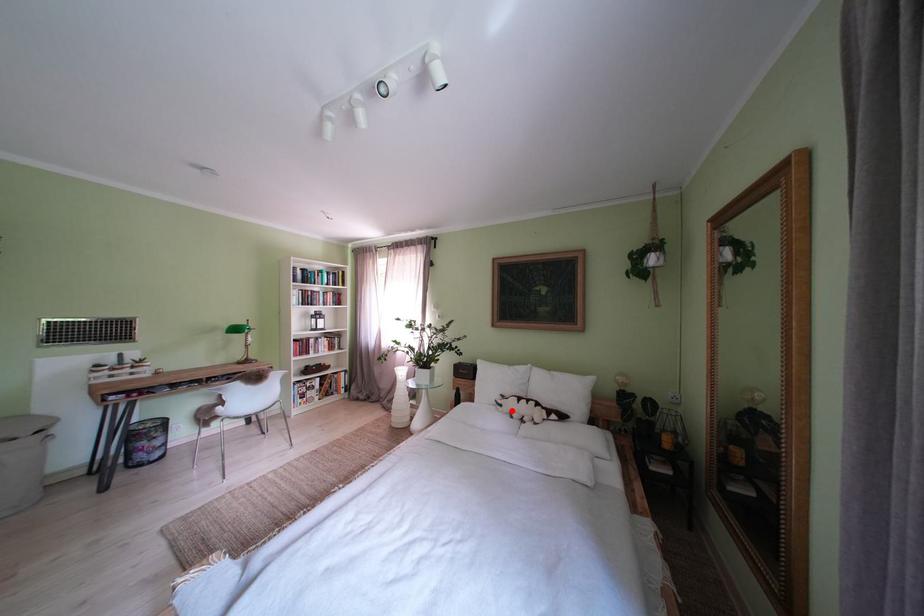
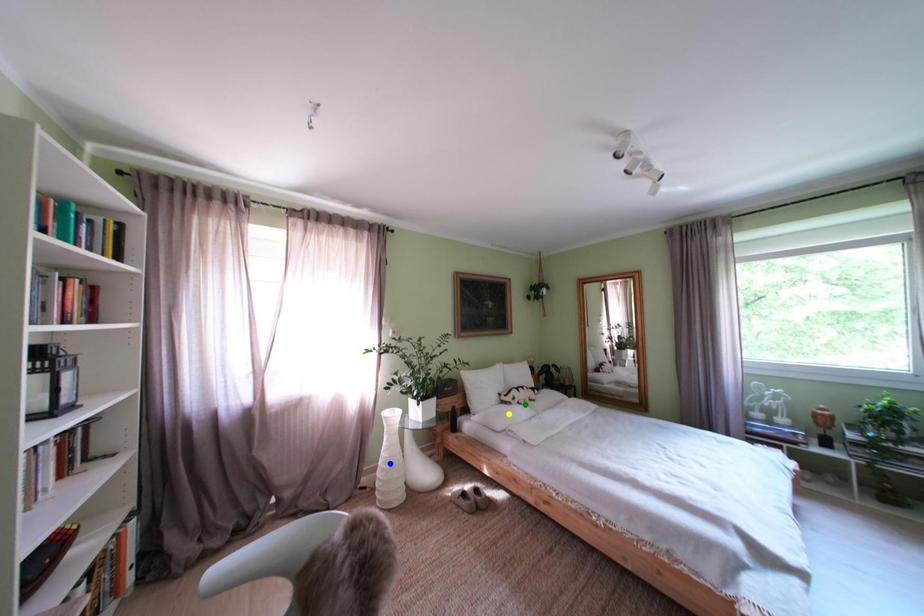
Question: I am providing you with two images of the same scene from different viewpoints. A red point is marked on the first image. You are given multiple points on the second image. Which point in image 2 is actually the same real-world point as the red point in image 1?

Choices:
 (A) green point
 (B) yellow point
 (C) blue point

Answer: (A)